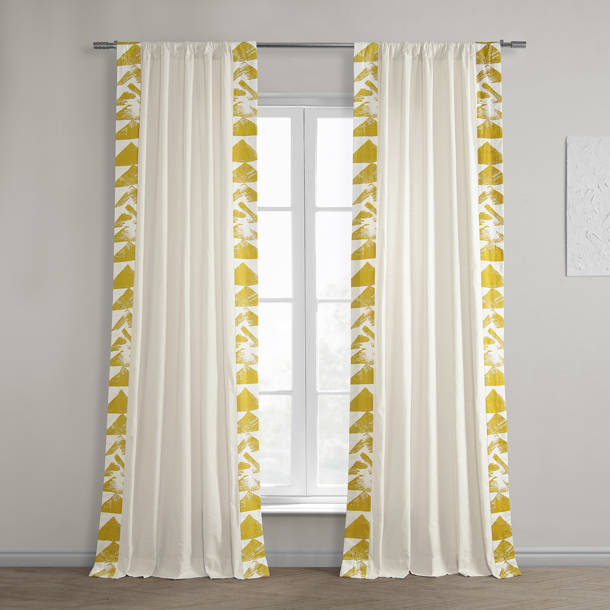
Identify the location of floor. This screenshot has height=610, width=610. (303, 595).